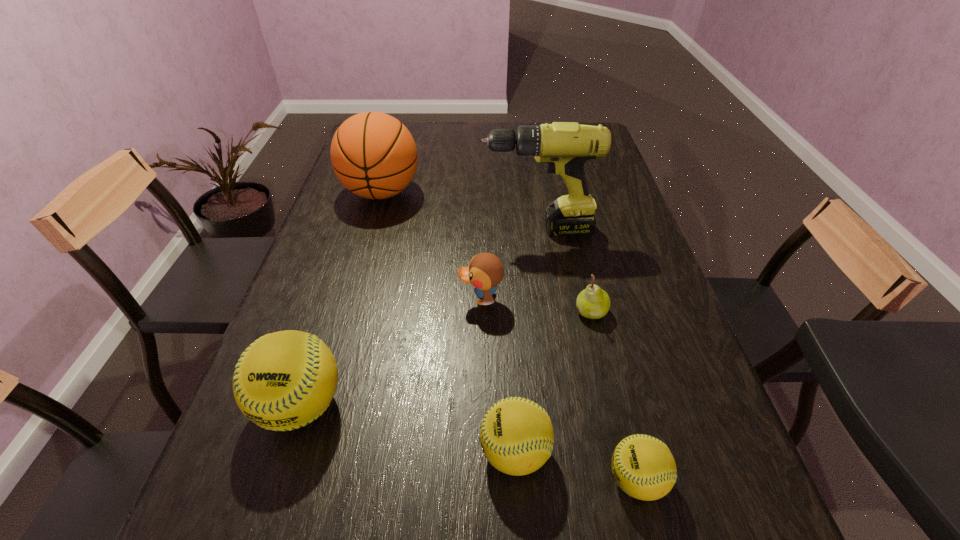
Identify the location of drill that is at the right edge. The image size is (960, 540). (565, 146).

The width and height of the screenshot is (960, 540). What are the coordinates of `object present at the near left corner` in the screenshot? It's located at (284, 380).

Where is `object situated at the near right corner`? This screenshot has width=960, height=540. object situated at the near right corner is located at coordinates (644, 468).

In the image, there is a desktop. Identify the location of vacant space at the near edge. This screenshot has height=540, width=960. (548, 480).

Find the location of `vacant space at the left edge of the desktop`. vacant space at the left edge of the desktop is located at coordinates (313, 255).

Image resolution: width=960 pixels, height=540 pixels. In the image, there is a desktop. Find the location of `vacant space at the right edge`. vacant space at the right edge is located at coordinates (627, 204).

Where is `free space at the near left corner`? The height and width of the screenshot is (540, 960). free space at the near left corner is located at coordinates (x=317, y=449).

Locate an element on the screen. This screenshot has height=540, width=960. free space between the tallest softball and the duck is located at coordinates (391, 352).

Identify the location of empty space that is in between the tallest object and the basketball. 459,211.

You are a GUI agent. You are given a task and a screenshot of the screen. Output one action in this format:
    pyautogui.click(x=<x>, y=<y>)
    Task: Click on the empty space between the second softball from right to left and the drill
    
    Given the screenshot: What is the action you would take?
    pyautogui.click(x=526, y=341)